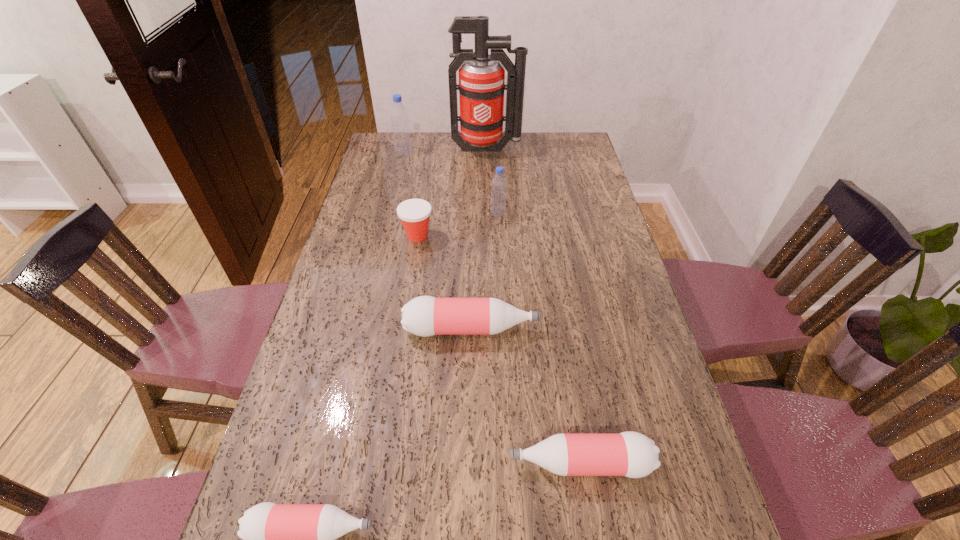
Where is `red fire extinguisher`? This screenshot has height=540, width=960. red fire extinguisher is located at coordinates (481, 87).

Where is `fire extinguisher`? Image resolution: width=960 pixels, height=540 pixels. fire extinguisher is located at coordinates (481, 87).

Identify the location of the tallest bottle. The height and width of the screenshot is (540, 960). (399, 116).

The height and width of the screenshot is (540, 960). Identify the location of the left blue bottle. (399, 116).

Locate an element on the screen. The width and height of the screenshot is (960, 540). the smaller blue bottle is located at coordinates [x=499, y=183].

This screenshot has width=960, height=540. I want to click on the fifth shortest object, so click(x=499, y=183).

Where is `red-orange Dixie cup`? The height and width of the screenshot is (540, 960). red-orange Dixie cup is located at coordinates (414, 213).

At what (x,y) coordinates should I click in order to perform the action: click on the fourth farthest object. Please return your answer as a coordinate pair (x, y). Looking at the image, I should click on pyautogui.click(x=414, y=213).

Where is `the farthest pink bottle`? The height and width of the screenshot is (540, 960). the farthest pink bottle is located at coordinates (424, 316).

The height and width of the screenshot is (540, 960). What are the coordinates of `the third nearest bottle` in the screenshot? It's located at pyautogui.click(x=424, y=316).